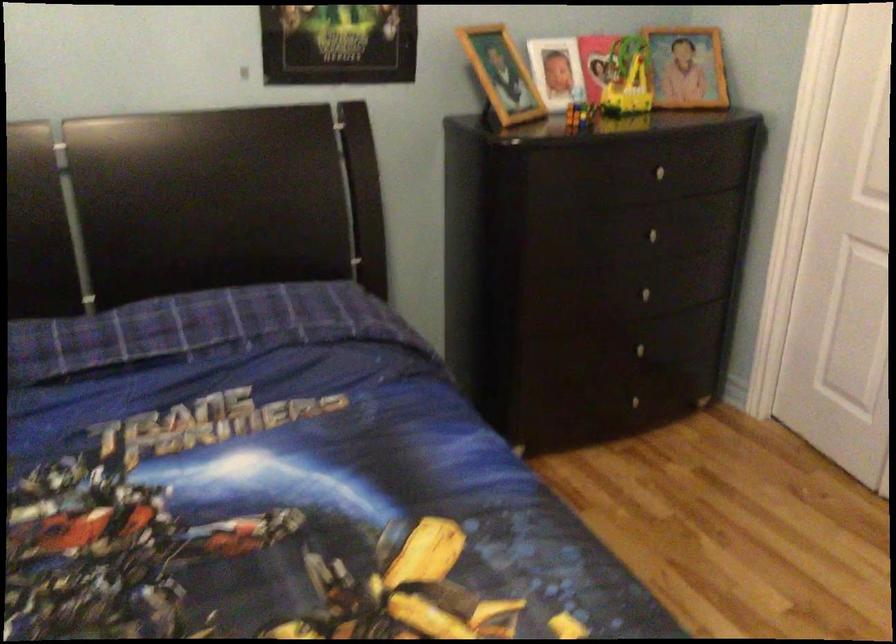
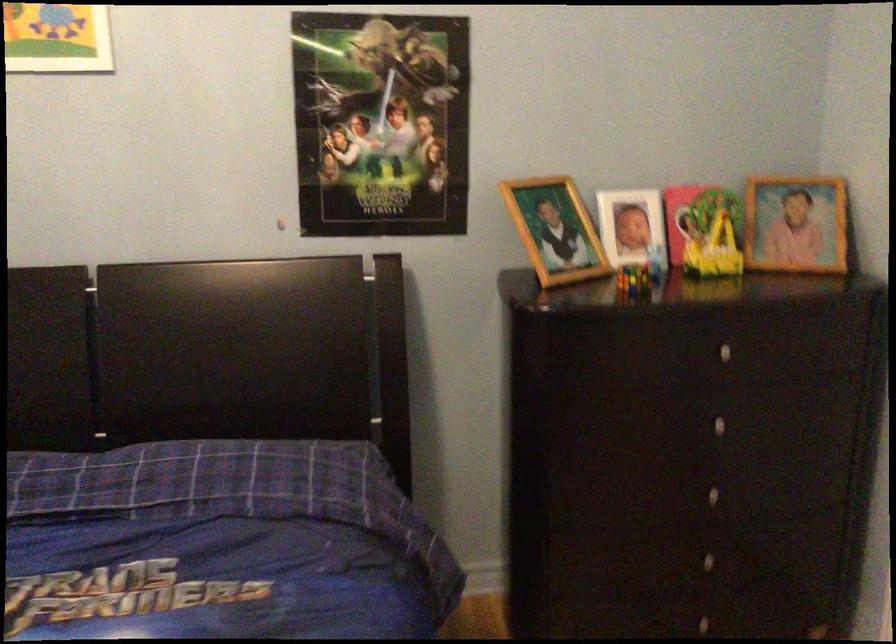
What movement of the cameraman would produce the second image?

The cameraman walked toward right, forward.